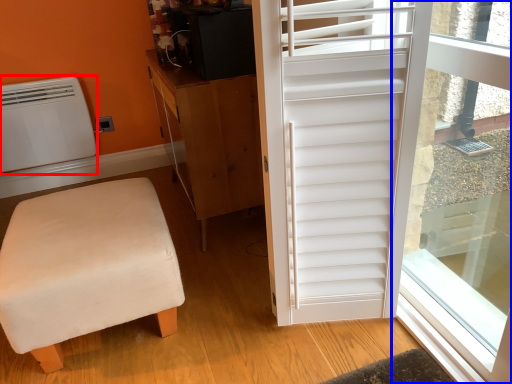
Question: Which point is closer to the camera, air conditioning (highlighted by a red box) or window screen (highlighted by a blue box)?

Choices:
 (A) air conditioning
 (B) window screen

Answer: (B)